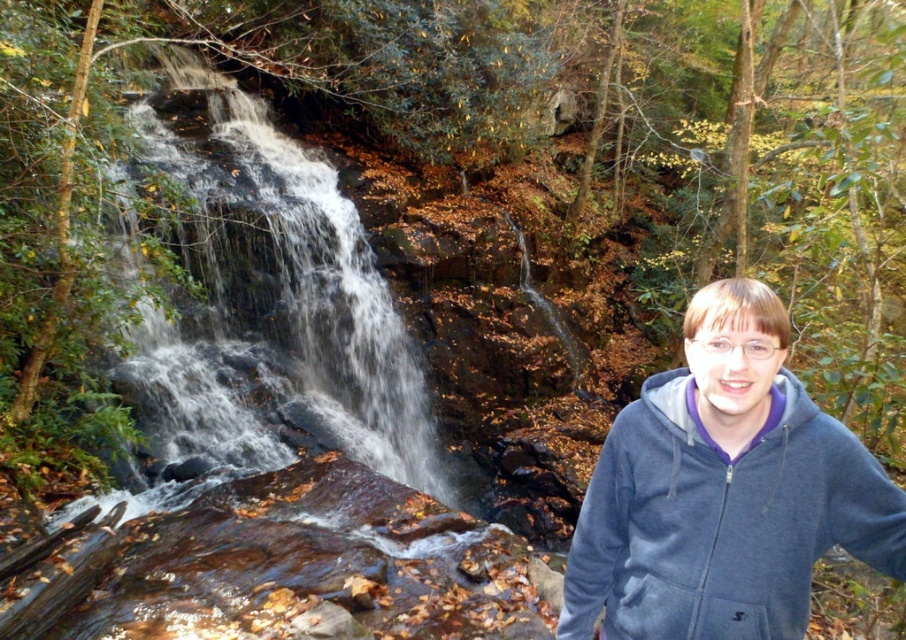
Question: Is white frothy water at left to the right of dark blue fleece sweatshirt at right from the viewer's perspective?

Choices:
 (A) no
 (B) yes

Answer: (A)

Question: Among these points, which one is nearest to the camera?

Choices:
 (A) (403, 464)
 (B) (777, 508)

Answer: (B)

Question: Observing the image, what is the correct spatial positioning of white frothy water at left in reference to dark blue fleece sweatshirt at right?

Choices:
 (A) above
 (B) below

Answer: (B)

Question: Is white frothy water at left smaller than dark blue fleece sweatshirt at right?

Choices:
 (A) no
 (B) yes

Answer: (B)